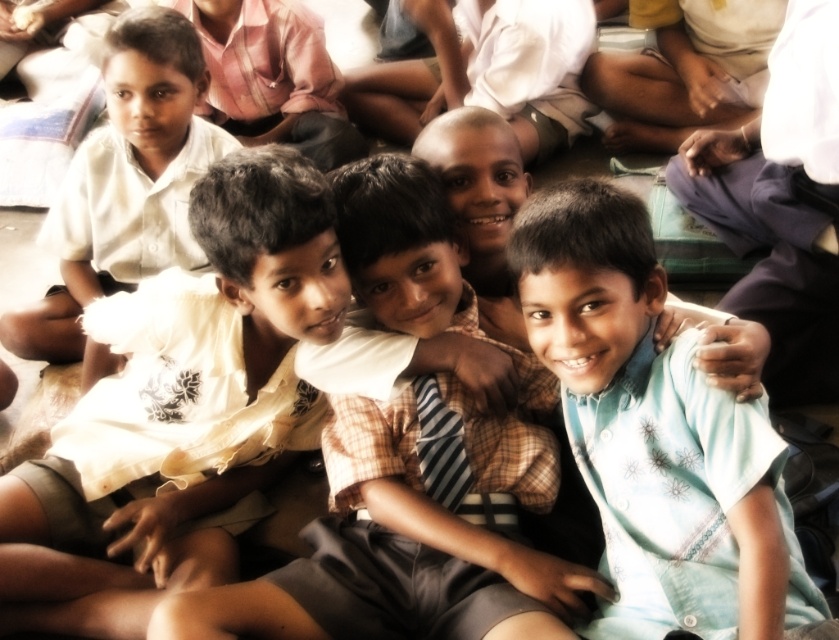
Does light blue cotton shirt at center have a lesser height compared to white shirt at left?

Yes, light blue cotton shirt at center is shorter than white shirt at left.

Describe the element at coordinates (655, 433) in the screenshot. I see `light blue cotton shirt at center` at that location.

At what (x,y) coordinates should I click in order to perform the action: click on light blue cotton shirt at center. Please return your answer as a coordinate pair (x, y). Looking at the image, I should click on coord(655,433).

Describe the element at coordinates (391, 557) in the screenshot. Image resolution: width=839 pixels, height=640 pixels. I see `light blue shirt at center` at that location.

Is point (470, 323) closer to viewer compared to point (168, 253)?

Yes, it is.

Where is `light blue shirt at center`? The image size is (839, 640). light blue shirt at center is located at coordinates (391, 557).

Does white shirt at left have a smaller size compared to striped fabric tie at center?

Incorrect, white shirt at left is not smaller in size than striped fabric tie at center.

Does point (165, 246) lie in front of point (459, 500)?

That is False.

Which is behind, point (77, 192) or point (420, 392)?

The point (77, 192) is behind.

The image size is (839, 640). Identify the location of white shirt at left. (124, 184).